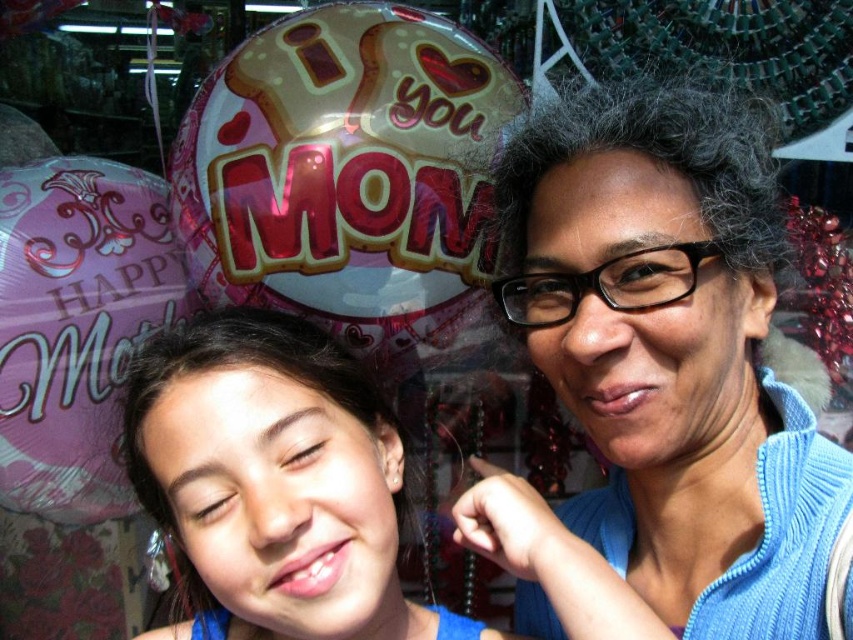
You are a photographer trying to capture a clear shot of both the pink metallic balloon at upper center and the smooth blue shirt at center. Which object should you focus on first to ensure both are in focus?

You should focus on the pink metallic balloon at upper center first because it is closer to you than the smooth blue shirt at center. By focusing on the closer object, the background object will also be in focus due to the depth of field.

You are a photographer trying to capture the perfect shot of the scene. The pink metallic balloon at upper center is crucial for the composition. Based on its coordinates, where should you position your camera to ensure it is centered in the frame?

The pink metallic balloon at upper center is located at coordinates point (346, 172), so positioning the camera to center it would require aligning the frame so the balloon is at that specific coordinate point.